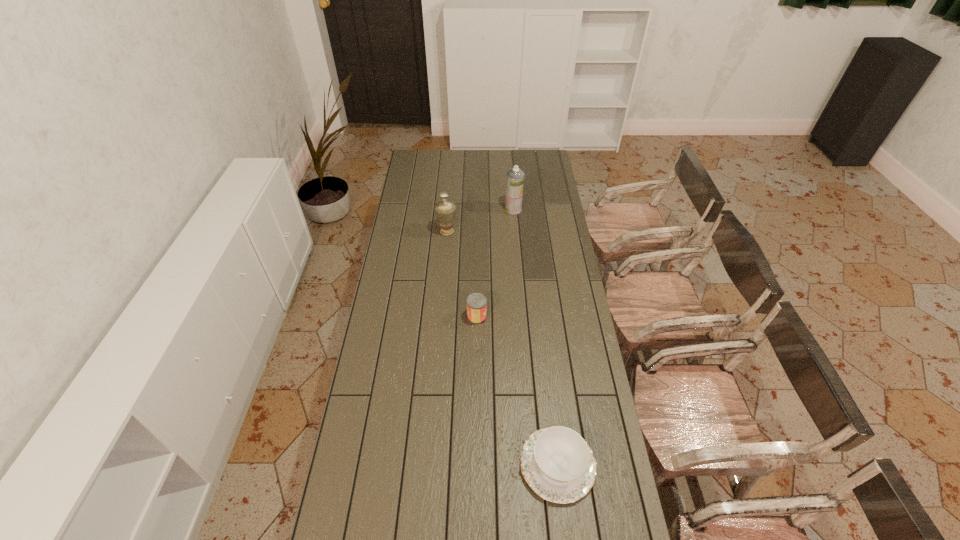
The width and height of the screenshot is (960, 540). Identify the location of vacant region between the nearest object and the second farthest object. tap(502, 348).

Identify the location of free space between the chinaware and the aerosol can. (536, 337).

Locate an element on the screen. The height and width of the screenshot is (540, 960). free area in between the third nearest object and the nearest object is located at coordinates (502, 348).

Identify the location of free space between the can and the third shortest object. The height and width of the screenshot is (540, 960). (462, 274).

You are a GUI agent. You are given a task and a screenshot of the screen. Output one action in this format:
    pyautogui.click(x=<x>, y=<y>)
    Task: Click on the vacant point located between the second farthest object and the third farthest object
    The width and height of the screenshot is (960, 540).
    Given the screenshot: What is the action you would take?
    pyautogui.click(x=462, y=274)

Identify the location of free space between the third farthest object and the aerosol can. The image size is (960, 540). (495, 263).

Identify the location of object that is the second closest to the third shortest object. (476, 303).

Identify which object is the third closest to the second farthest object. Please provide its 2D coordinates. Your answer should be formatted as a tuple, i.e. [(x, y)], where the tuple contains the x and y coordinates of a point satisfying the conditions above.

[(557, 463)]